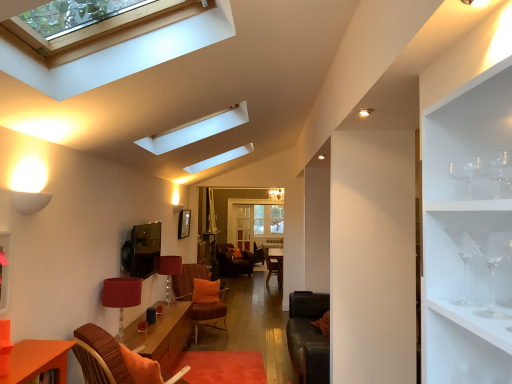
Question: Is clear glass skylight at upper center looking in the opposite direction of clear glass wine glass at upper right, which is the 2th wine glass from front to back?

Choices:
 (A) yes
 (B) no

Answer: (B)

Question: Does clear glass skylight at upper center have a greater height compared to clear glass wine glass at upper right, which is the 2th wine glass from front to back?

Choices:
 (A) yes
 (B) no

Answer: (A)

Question: From the image's perspective, does clear glass skylight at upper center appear lower than clear glass wine glass at upper right, which is the second wine glass in back-to-front order?

Choices:
 (A) no
 (B) yes

Answer: (A)

Question: Is clear glass skylight at upper center to the right of clear glass wine glass at upper right, which is the 2th wine glass from front to back, from the viewer's perspective?

Choices:
 (A) yes
 (B) no

Answer: (B)

Question: Can you confirm if clear glass skylight at upper center is thinner than clear glass wine glass at upper right, which is the 2th wine glass from front to back?

Choices:
 (A) yes
 (B) no

Answer: (B)

Question: Visually, is clear glass wine glass at right, which is counted as the third wine glass, starting from the front, positioned to the left or to the right of matte red lampshade at center, which appears as the first lamp when viewed from the back?

Choices:
 (A) left
 (B) right

Answer: (B)

Question: Is clear glass wine glass at right, the 1th wine glass in the back-to-front sequence, taller or shorter than matte red lampshade at center, the 2th lamp from the front?

Choices:
 (A) tall
 (B) short

Answer: (B)

Question: Is clear glass wine glass at right, which is counted as the third wine glass, starting from the front, inside or outside of matte red lampshade at center, which appears as the first lamp when viewed from the back?

Choices:
 (A) inside
 (B) outside

Answer: (B)

Question: Considering their positions, is clear glass wine glass at right, the 1th wine glass in the back-to-front sequence, located in front of or behind matte red lampshade at center, which appears as the first lamp when viewed from the back?

Choices:
 (A) behind
 (B) front

Answer: (B)

Question: Considering the positions of orange fabric swivel chair at center, placed as the 2th swivel chair when sorted from front to back, and clear glass wine glass at right, the 1th wine glass in the back-to-front sequence, in the image, is orange fabric swivel chair at center, placed as the 2th swivel chair when sorted from front to back, bigger or smaller than clear glass wine glass at right, the 1th wine glass in the back-to-front sequence,?

Choices:
 (A) big
 (B) small

Answer: (A)

Question: In terms of width, does orange fabric swivel chair at center, placed as the 2th swivel chair when sorted from front to back, look wider or thinner when compared to clear glass wine glass at right, which is counted as the third wine glass, starting from the front?

Choices:
 (A) thin
 (B) wide

Answer: (B)

Question: Relative to clear glass wine glass at right, which is counted as the third wine glass, starting from the front, is orange fabric swivel chair at center, placed as the 1th swivel chair when sorted from back to front, in front or behind?

Choices:
 (A) behind
 (B) front

Answer: (A)

Question: In the image, is orange fabric swivel chair at center, placed as the 1th swivel chair when sorted from back to front, on the left side or the right side of clear glass wine glass at right, which is counted as the third wine glass, starting from the front?

Choices:
 (A) left
 (B) right

Answer: (A)

Question: Is orange fabric pillow at center wider or thinner than pink matte shelf at left?

Choices:
 (A) wide
 (B) thin

Answer: (A)

Question: Looking at the image, does orange fabric pillow at center seem bigger or smaller compared to pink matte shelf at left?

Choices:
 (A) big
 (B) small

Answer: (A)